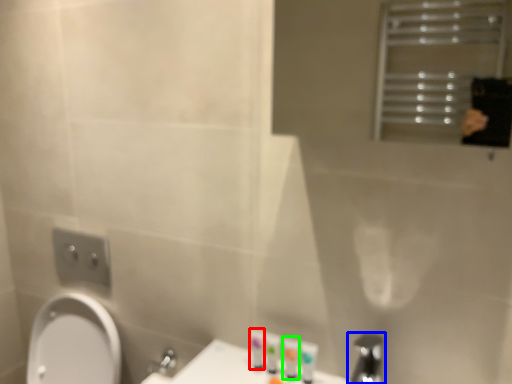
Question: Which object is positioned closest to toiletry (highlighted by a red box)? Select from tap (highlighted by a blue box) and toiletry (highlighted by a green box).

Choices:
 (A) tap
 (B) toiletry

Answer: (B)